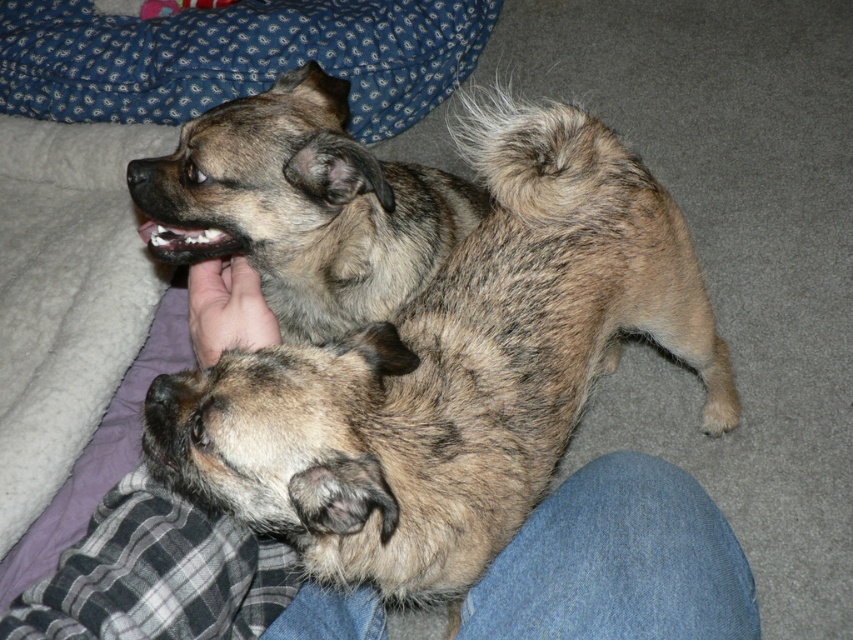
Between brown speckled fur dog at center and soft skin hand at center, which one has less height?

soft skin hand at center

Does brown speckled fur dog at center appear under soft skin hand at center?

Indeed, brown speckled fur dog at center is positioned under soft skin hand at center.

From the picture: Who is more forward, (202,460) or (206,262)?

Point (202,460)

Where is `brown speckled fur dog at center`? brown speckled fur dog at center is located at coordinates pyautogui.click(x=412, y=324).